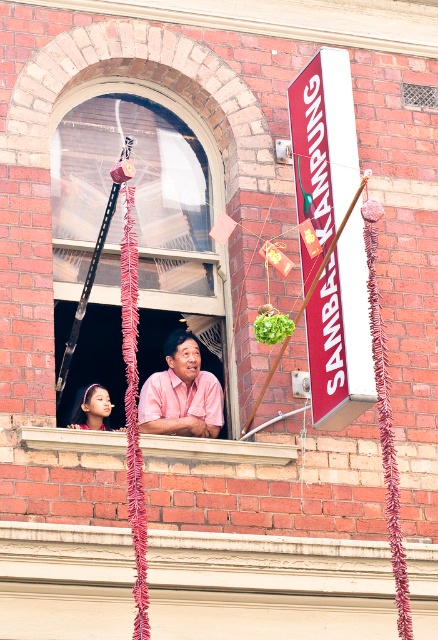
Question: Observing the image, what is the correct spatial positioning of clear glass window at center in reference to smooth skin face at window left?

Choices:
 (A) right
 (B) left

Answer: (A)

Question: Is clear glass window at center in front of pink matte shirt at window?

Choices:
 (A) yes
 (B) no

Answer: (B)

Question: Is clear glass window at center to the left of smooth skin face at window left from the viewer's perspective?

Choices:
 (A) yes
 (B) no

Answer: (B)

Question: Which object is closer to the camera taking this photo?

Choices:
 (A) clear glass window at center
 (B) smooth skin face at window left
 (C) pink matte shirt at window
 (D) wooden at lower center

Answer: (D)

Question: Based on their relative distances, which object is farther from the smooth skin face at window left?

Choices:
 (A) wooden at lower center
 (B) pink matte shirt at window

Answer: (A)

Question: Which point appears closest to the camera in this image?

Choices:
 (A) (258, 456)
 (B) (85, 413)
 (C) (105, 268)
 (D) (187, 426)

Answer: (A)